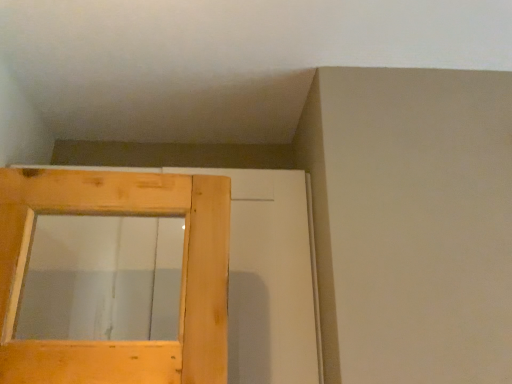
Question: Should I look upward or downward to see wooden door at left?

Choices:
 (A) down
 (B) up

Answer: (A)